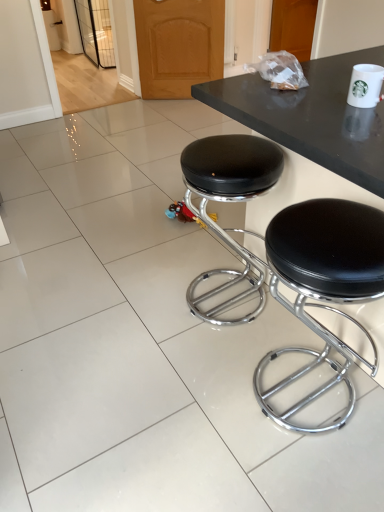
Question: Is black leather stool at center, acting as the second stool starting from the right, taller or shorter than white ceramic mug at upper right?

Choices:
 (A) short
 (B) tall

Answer: (B)

Question: Do you think black leather stool at center, acting as the second stool starting from the right, is within white ceramic mug at upper right, or outside of it?

Choices:
 (A) inside
 (B) outside

Answer: (B)

Question: Which of these objects is positioned farthest from the black leather stool at center, which is the first stool from right to left?

Choices:
 (A) black leather stool at center, acting as the second stool starting from the right
 (B) white ceramic mug at upper right

Answer: (B)

Question: Which of these objects is positioned closest to the black leather stool at center, which is the first stool from right to left?

Choices:
 (A) black leather stool at center, acting as the second stool starting from the right
 (B) white ceramic mug at upper right

Answer: (A)